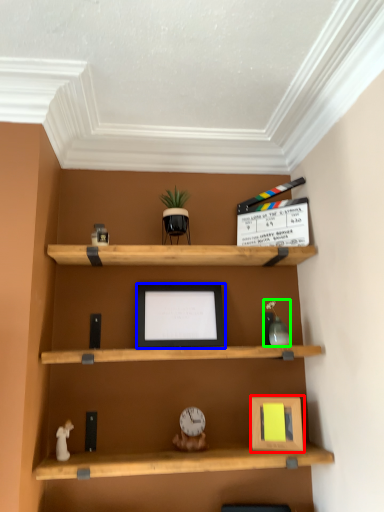
Question: Which object is positioned closest to picture frame (highlighted by a red box)? Select from picture frame (highlighted by a blue box) and toy (highlighted by a green box).

Choices:
 (A) picture frame
 (B) toy

Answer: (B)